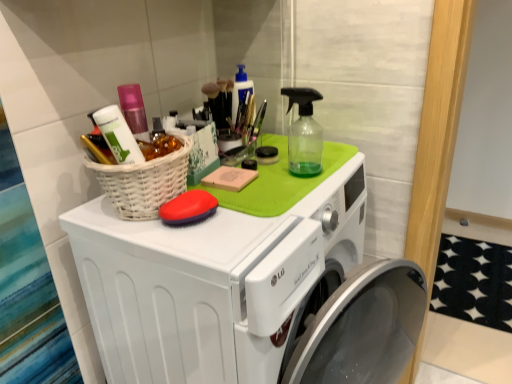
Question: Considering the positions of point (209, 198) and point (258, 273), is point (209, 198) closer or farther from the camera than point (258, 273)?

Choices:
 (A) farther
 (B) closer

Answer: (A)

Question: From a real-world perspective, is red rubber brush at center above or below white plastic washing machine at upper center?

Choices:
 (A) below
 (B) above

Answer: (B)

Question: Which of these objects is positioned closest to the white plastic washing machine at upper center?

Choices:
 (A) white wicker basket at upper left
 (B) red rubber brush at center

Answer: (A)

Question: Which is nearer to the white wicker basket at upper left?

Choices:
 (A) white plastic washing machine at upper center
 (B) red rubber brush at center

Answer: (B)